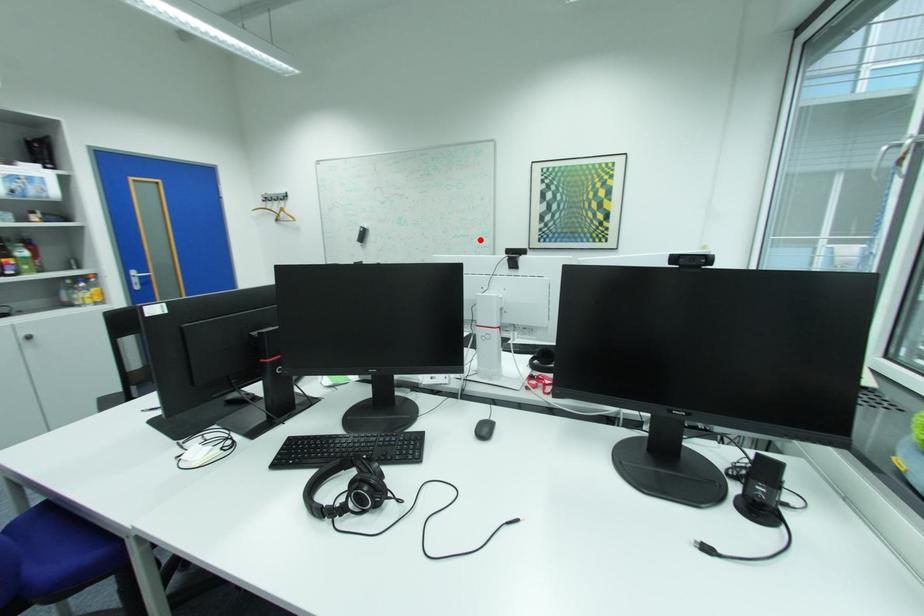
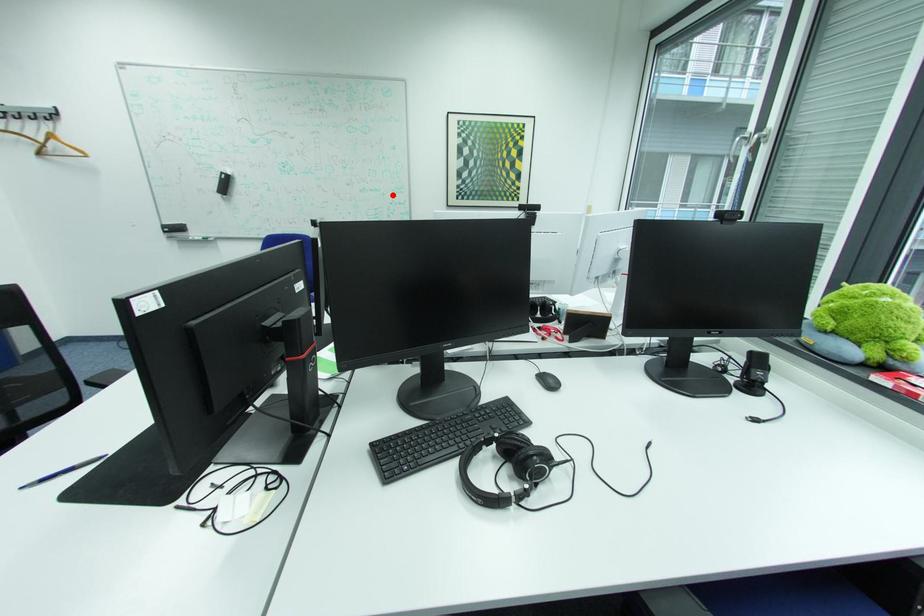
I am providing you with two images of the same scene from different viewpoints. A red point is marked on the first image and another point is marked on the second image. Do the highlighted points in image1 and image2 indicate the same real-world spot?

Yes